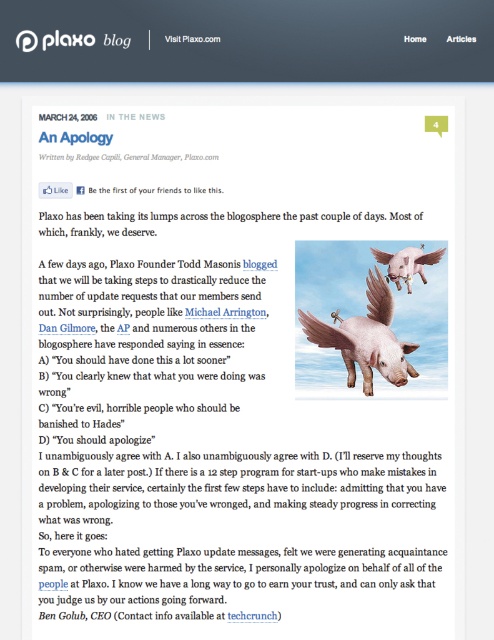
Based on the scene described, which object is located below the other? The matte pink pig at center or the pink feathered pig at upper right?

The matte pink pig at center is positioned under the pink feathered pig at upper right.

Based on the scene described, which object is larger between the matte pink pig at center and the pink feathered pig at upper right?

The matte pink pig at center is bigger than the pink feathered pig at upper right.

You are a web developer reviewing this blog post. You notice the matte pink pig at center and the black text at bottom right. Which element appears in front of the other?

The matte pink pig at center appears in front of the black text at bottom right because the black text at bottom right is behind it.